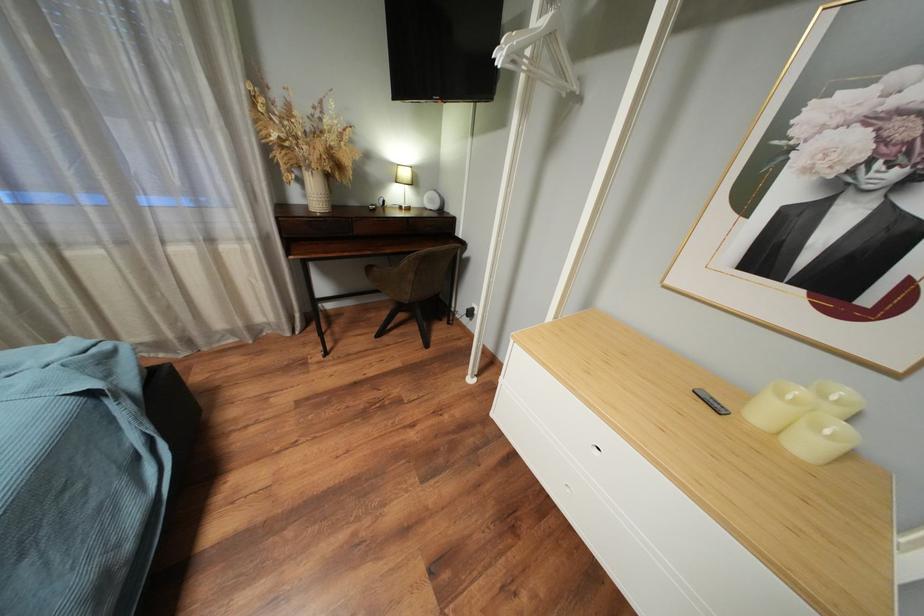
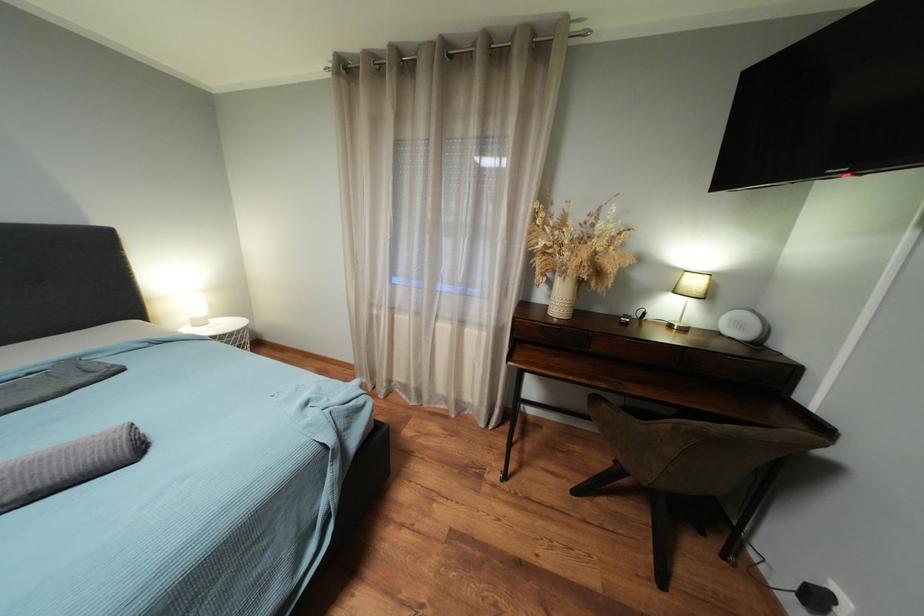
Question: The images are taken continuously from a first-person perspective. In which direction is your viewpoint rotating?

Choices:
 (A) Left
 (B) Right
 (C) Up
 (D) Down

Answer: (A)